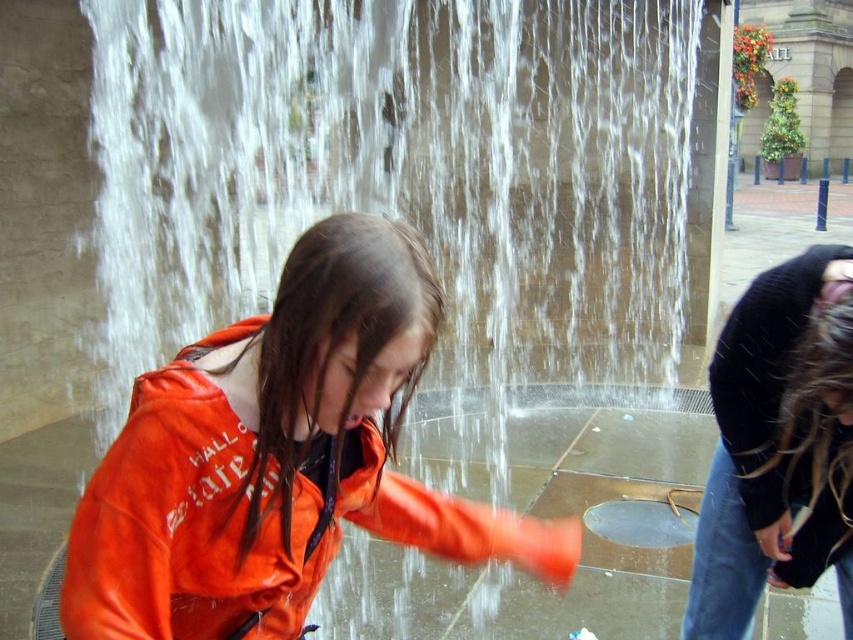
You are a photographer trying to capture the orange leather jacket at center and the black sweater at lower right in the same frame. Since you can only focus on one subject at a time, which one should you focus on to ensure the other remains in the background?

You should focus on the orange leather jacket at center because it is in front of the black sweater at lower right, so focusing on the front object will keep the background object in focus as well.

You are standing at the edge of the plaza and want to take a photo of the orange leather jacket at center. The camera you have can focus up to 6 meters. Will the jacket be in focus?

The orange leather jacket at center is 5.90 meters away from the camera, which is within the camera focus range of up to 6 meters. Therefore, the jacket will be in focus.